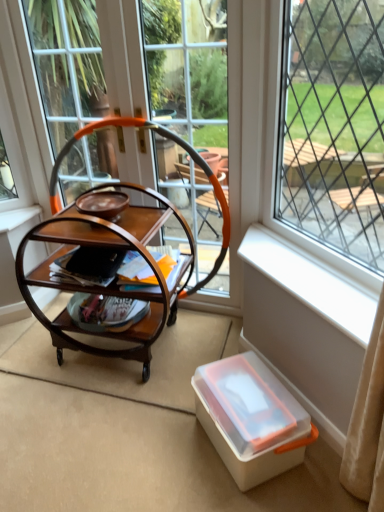
At what (x,y) coordinates should I click in order to perform the action: click on vacant space situated above matte brown plate at center (from a real-world perspective). Please return your answer as a coordinate pair (x, y). This screenshot has height=512, width=384. Looking at the image, I should click on (100, 193).